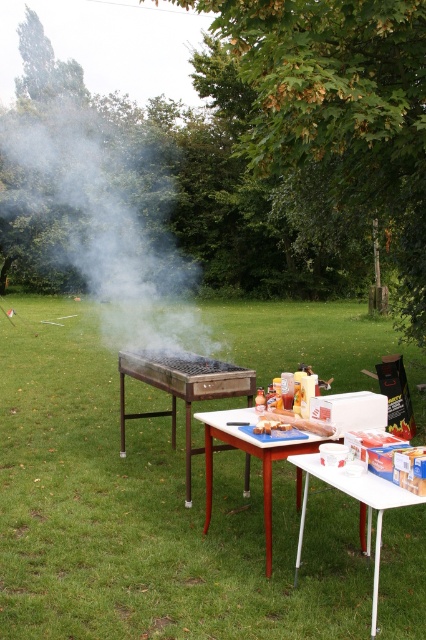
Question: Is green grass at center positioned in front of white plastic table at center?

Choices:
 (A) yes
 (B) no

Answer: (A)

Question: Which point is closer to the camera taking this photo?

Choices:
 (A) (164, 260)
 (B) (241, 440)

Answer: (B)

Question: Which point is closer to the camera?

Choices:
 (A) white plastic table at center
 (B) white smoke at left
 (C) white plastic table at lower right
 (D) green grass at center

Answer: (C)

Question: Does white smoke at left appear on the right side of wooden grill at center?

Choices:
 (A) yes
 (B) no

Answer: (B)

Question: Considering the real-world distances, which object is closest to the white smoke at left?

Choices:
 (A) white plastic table at center
 (B) green grass at center
 (C) white plastic table at lower right
 (D) wooden grill at center

Answer: (B)

Question: Can you confirm if white smoke at left is smaller than slightly toasted bread at center?

Choices:
 (A) no
 (B) yes

Answer: (A)